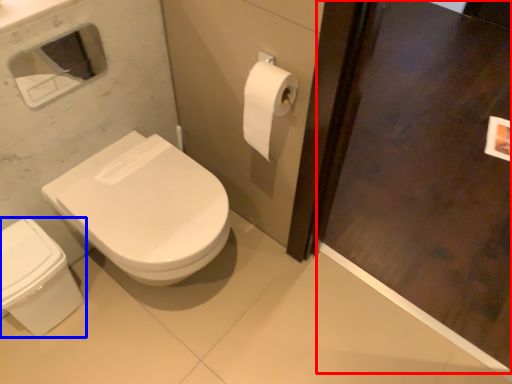
Question: Which point is closer to the camera, screen door (highlighted by a red box) or bidet (highlighted by a blue box)?

Choices:
 (A) screen door
 (B) bidet

Answer: (A)